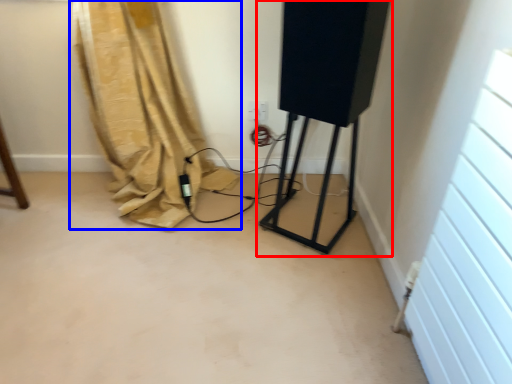
Question: Which object is closer to the camera taking this photo, equipment (highlighted by a red box) or curtain (highlighted by a blue box)?

Choices:
 (A) equipment
 (B) curtain

Answer: (A)